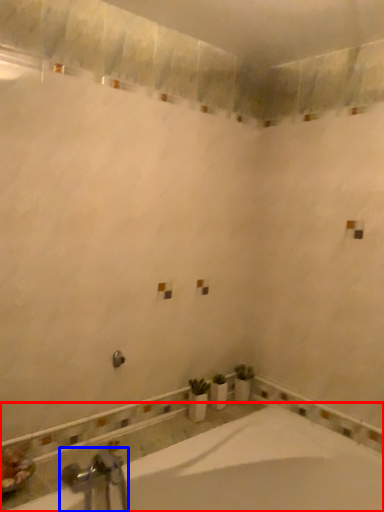
Question: Among these objects, which one is farthest to the camera, bathtub (highlighted by a red box) or tap (highlighted by a blue box)?

Choices:
 (A) bathtub
 (B) tap

Answer: (B)